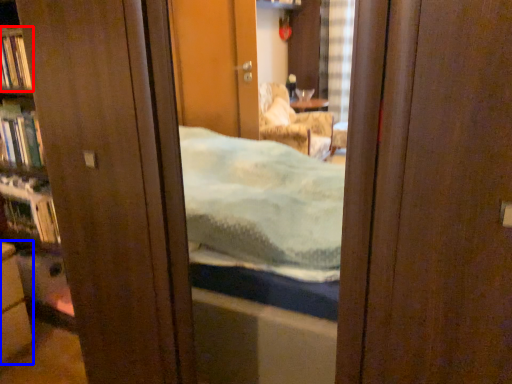
Question: Which object is further to the camera taking this photo, book (highlighted by a red box) or cabinetry (highlighted by a blue box)?

Choices:
 (A) book
 (B) cabinetry

Answer: (A)